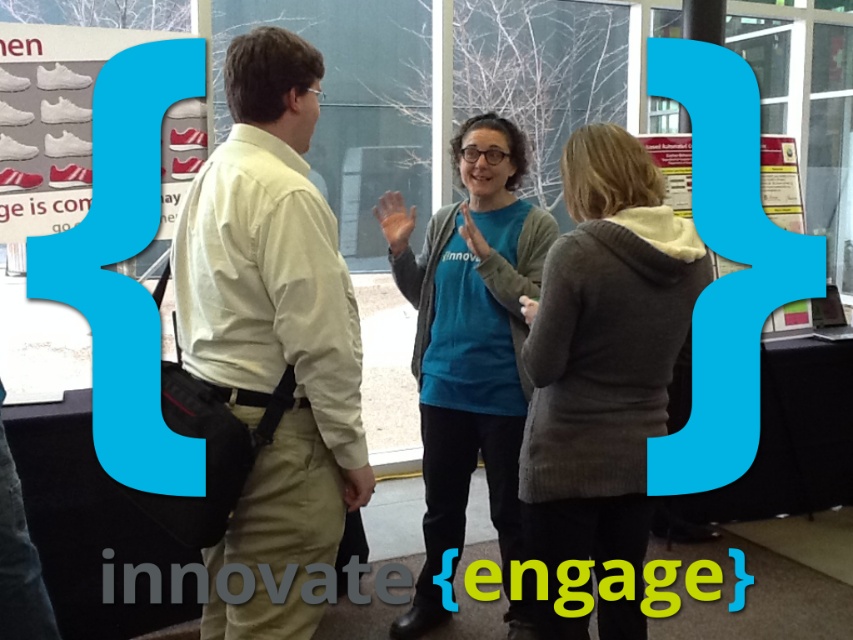
You are at a winter event and want to join the conversation between the light beige shirt at center and the gray knit sweater at center. Which person should you approach first if you want to stand on the right side of the group?

You should approach the gray knit sweater at center first because the light beige shirt at center is positioned on the left side of gray knit sweater at center, so the gray knit sweater at center is on the right side of the group.

You are standing at the origin point of the coordinate system in the image. You need to walk to the light beige shirt at center. What are the coordinates you need to move to?

The coordinates to move to are 0.531 in the x direction and 0.320 in the y direction.

You are a photographer at a public event. You want to take a photo of the gray knit sweater at center and the blue cotton shirt at center. The minimum distance your camera requires to focus properly is 20 inches. Will the camera be able to focus on both subjects clearly?

The gray knit sweater at center is 20.14 inches from the blue cotton shirt at center. Since the required minimum distance is 20 inches, the camera should be able to focus on both subjects clearly as the distance meets the requirement.